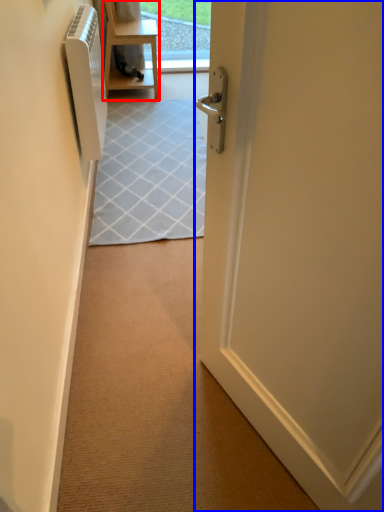
Question: Which point is further to the camera, furniture (highlighted by a red box) or door (highlighted by a blue box)?

Choices:
 (A) furniture
 (B) door

Answer: (A)